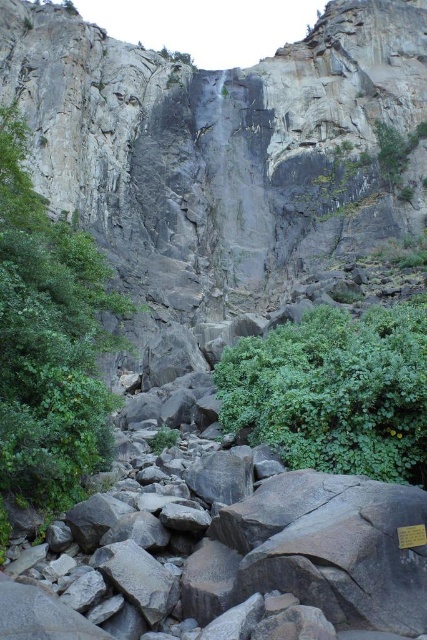
Which of these two, green leafy shrubs at center or green leafy bush at lower center, stands taller?

With more height is green leafy shrubs at center.

Which is more to the right, green leafy shrubs at center or green leafy bush at lower center?

green leafy bush at lower center is more to the right.

Identify the location of green leafy shrubs at center. (49, 342).